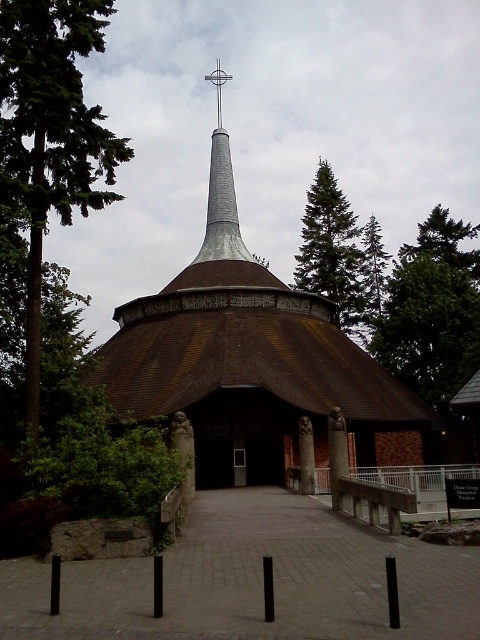
Question: Which point is closer to the camera taking this photo?

Choices:
 (A) (367, 256)
 (B) (218, 74)

Answer: (B)

Question: Which of the following is the closest to the observer?

Choices:
 (A) (334, 208)
 (B) (380, 301)
 (C) (367, 394)

Answer: (C)

Question: Is green leafy tree at upper left further to camera compared to silver metallic spire at center?

Choices:
 (A) no
 (B) yes

Answer: (A)

Question: Can you confirm if green leafy tree at upper right is smaller than silver metallic cross at upper center?

Choices:
 (A) yes
 (B) no

Answer: (B)

Question: Does brown wooden church at center have a greater width compared to silver metallic cross at upper center?

Choices:
 (A) yes
 (B) no

Answer: (A)

Question: Which point is farther from the camera taking this photo?

Choices:
 (A) pos(218,61)
 (B) pos(217,96)

Answer: (A)